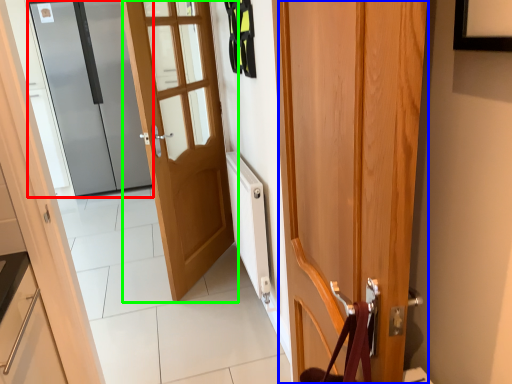
Question: Estimate the real-world distances between objects in this image. Which object is farther from door (highlighted by a red box), door (highlighted by a blue box) or door (highlighted by a green box)?

Choices:
 (A) door
 (B) door

Answer: (A)